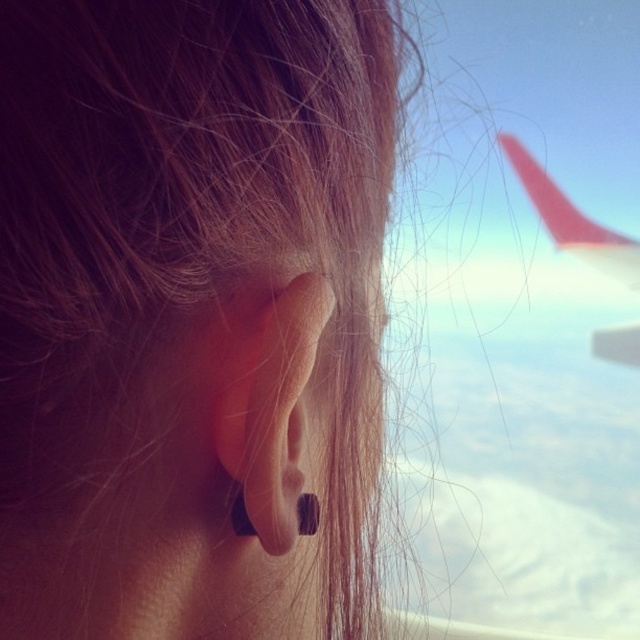
Does black matte ear at center have a lesser width compared to black matte earring at ear?

Incorrect, black matte ear at center's width is not less than black matte earring at ear's.

Can you confirm if black matte ear at center is wider than black matte earring at ear?

Correct, the width of black matte ear at center exceeds that of black matte earring at ear.

Locate an element on the screen. The height and width of the screenshot is (640, 640). black matte ear at center is located at coordinates [x=269, y=404].

Based on the photo, is black matte ear at center to the right of smooth red airplane wing at upper right from the viewer's perspective?

Incorrect, black matte ear at center is not on the right side of smooth red airplane wing at upper right.

Can you confirm if black matte ear at center is taller than smooth red airplane wing at upper right?

Incorrect, black matte ear at center's height is not larger of smooth red airplane wing at upper right's.

Is point (301, 381) positioned in front of point (572, 212)?

Yes, point (301, 381) is in front of point (572, 212).

This screenshot has width=640, height=640. Find the location of `black matte ear at center`. black matte ear at center is located at coordinates (269, 404).

Is smooth red airplane wing at upper right below black matte earring at ear?

Actually, smooth red airplane wing at upper right is above black matte earring at ear.

In the scene shown: Who is higher up, smooth red airplane wing at upper right or black matte earring at ear?

smooth red airplane wing at upper right

Which is behind, point (540, 193) or point (301, 497)?

The point (540, 193) is behind.

Locate an element on the screen. The width and height of the screenshot is (640, 640). smooth red airplane wing at upper right is located at coordinates (572, 220).